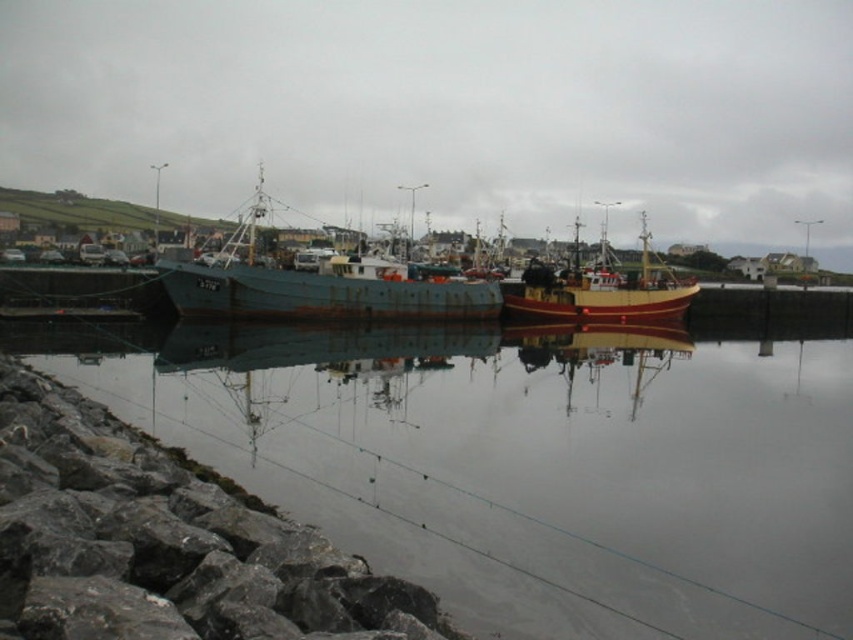
Question: Which point is farther from the camera taking this photo?

Choices:
 (A) (541, 291)
 (B) (485, 532)

Answer: (A)

Question: Does gray rock at lower left appear on the left side of rusty metal boat at center?

Choices:
 (A) yes
 (B) no

Answer: (B)

Question: Which is nearer to the smooth reflective water at center?

Choices:
 (A) gray rock at lower left
 (B) rusty metal boat at center
 (C) wooden boat at center

Answer: (A)

Question: Is gray rock at lower left closer to camera compared to rusty metal boat at center?

Choices:
 (A) yes
 (B) no

Answer: (A)

Question: Does gray rock at lower left appear under rusty metal boat at center?

Choices:
 (A) no
 (B) yes

Answer: (B)

Question: Which of these objects is positioned closest to the gray rock at lower left?

Choices:
 (A) wooden boat at center
 (B) rusty metal boat at center
 (C) smooth reflective water at center

Answer: (C)